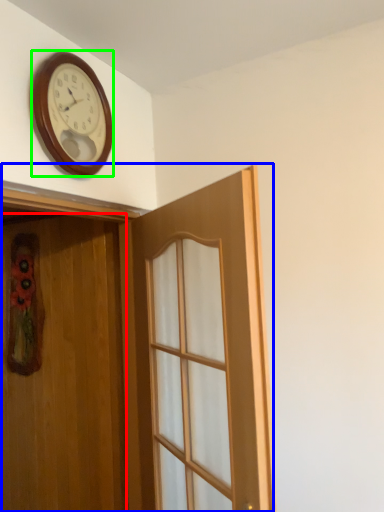
Question: Based on their relative distances, which object is nearer to door (highlighted by a red box)? Choose from door (highlighted by a blue box) and wall clock (highlighted by a green box).

Choices:
 (A) door
 (B) wall clock

Answer: (A)